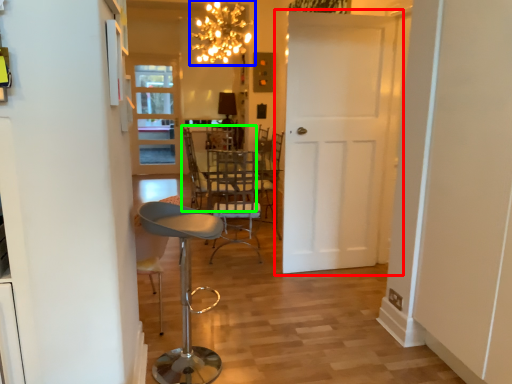
Question: Which object is positioned farthest from door (highlighted by a red box)? Select from lamp (highlighted by a blue box) and chair (highlighted by a green box).

Choices:
 (A) lamp
 (B) chair

Answer: (A)